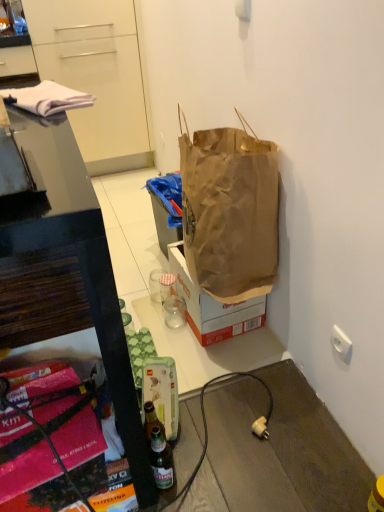
Question: Does brown paper bag at center have a greater width compared to white cloth at upper left?

Choices:
 (A) yes
 (B) no

Answer: (A)

Question: Does brown paper bag at center have a lesser width compared to white cloth at upper left?

Choices:
 (A) yes
 (B) no

Answer: (B)

Question: From the image's perspective, would you say brown paper bag at center is shown under white cloth at upper left?

Choices:
 (A) no
 (B) yes

Answer: (B)

Question: From a real-world perspective, is brown paper bag at center physically above white cloth at upper left?

Choices:
 (A) yes
 (B) no

Answer: (B)

Question: From the image's perspective, is brown paper bag at center on top of white cloth at upper left?

Choices:
 (A) yes
 (B) no

Answer: (B)

Question: Is brown paper bag at center situated inside white cloth at upper left or outside?

Choices:
 (A) inside
 (B) outside

Answer: (B)

Question: From the image's perspective, relative to white cloth at upper left, is brown paper bag at center above or below?

Choices:
 (A) above
 (B) below

Answer: (B)

Question: From a real-world perspective, is brown paper bag at center positioned above or below white cloth at upper left?

Choices:
 (A) below
 (B) above

Answer: (A)

Question: In terms of width, does brown paper bag at center look wider or thinner when compared to white cloth at upper left?

Choices:
 (A) thin
 (B) wide

Answer: (B)

Question: From their relative heights in the image, would you say white plastic power outlet at lower right is taller or shorter than white cloth at upper left?

Choices:
 (A) short
 (B) tall

Answer: (A)

Question: From the image's perspective, is white plastic power outlet at lower right above or below white cloth at upper left?

Choices:
 (A) below
 (B) above

Answer: (A)

Question: Considering the relative positions of white plastic power outlet at lower right and white cloth at upper left in the image provided, is white plastic power outlet at lower right to the left or to the right of white cloth at upper left?

Choices:
 (A) right
 (B) left

Answer: (A)

Question: Is white plastic power outlet at lower right spatially inside white cloth at upper left, or outside of it?

Choices:
 (A) inside
 (B) outside

Answer: (B)

Question: Based on their sizes in the image, would you say white plastic power outlet at lower right is bigger or smaller than transparent glass at center, arranged as the second coffee cup when viewed from the back?

Choices:
 (A) small
 (B) big

Answer: (A)

Question: Considering their positions, is white plastic power outlet at lower right located in front of or behind transparent glass at center, positioned as the first coffee cup in front-to-back order?

Choices:
 (A) front
 (B) behind

Answer: (A)